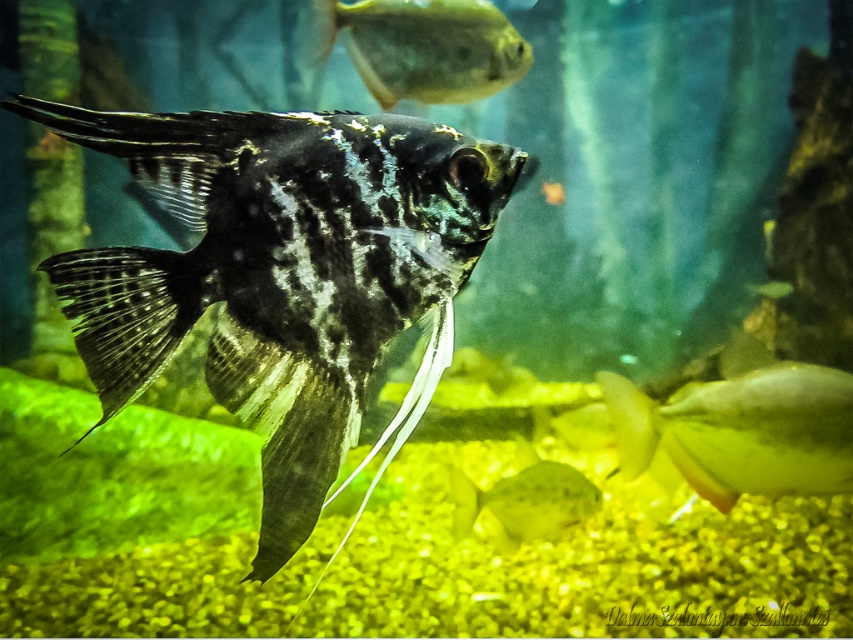
Does shiny black fish at center have a greater width compared to shiny yellow fish at lower right?

No, shiny black fish at center is not wider than shiny yellow fish at lower right.

Is point (166, 296) more distant than point (804, 376)?

No, (166, 296) is in front of (804, 376).

Where is `shiny black fish at center`? The width and height of the screenshot is (853, 640). shiny black fish at center is located at coordinates pyautogui.click(x=279, y=269).

Who is higher up, shiny black fish at center or translucent yellowish fish at lower center?

shiny black fish at center

Does point (393, 150) lie behind point (529, 467)?

That is False.

The height and width of the screenshot is (640, 853). I want to click on shiny black fish at center, so click(x=279, y=269).

In the scene shown: Can you confirm if shiny yellow fish at upper center is positioned to the left of translucent yellowish fish at lower center?

Indeed, shiny yellow fish at upper center is positioned on the left side of translucent yellowish fish at lower center.

Is shiny yellow fish at upper center taller than translucent yellowish fish at lower center?

Yes.

The height and width of the screenshot is (640, 853). I want to click on shiny yellow fish at upper center, so click(x=422, y=48).